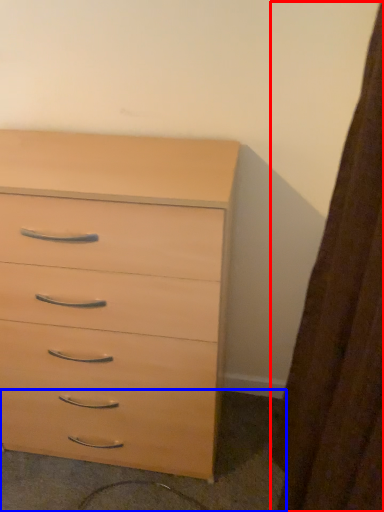
Question: Which point is further to the camera, curtain (highlighted by a red box) or concrete (highlighted by a blue box)?

Choices:
 (A) curtain
 (B) concrete

Answer: (B)